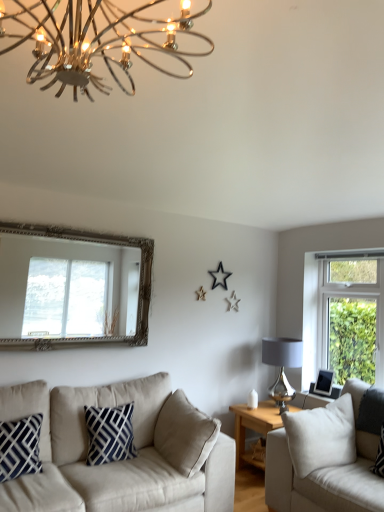
Question: Does black plastic picture frame at right lie in front of wooden side table at center?

Choices:
 (A) no
 (B) yes

Answer: (A)

Question: Is the depth of black plastic picture frame at right greater than that of wooden side table at center?

Choices:
 (A) no
 (B) yes

Answer: (B)

Question: From a real-world perspective, is black plastic picture frame at right located higher than wooden side table at center?

Choices:
 (A) no
 (B) yes

Answer: (B)

Question: Does black plastic picture frame at right have a larger size compared to wooden side table at center?

Choices:
 (A) no
 (B) yes

Answer: (A)

Question: From a real-world perspective, is black plastic picture frame at right below wooden side table at center?

Choices:
 (A) yes
 (B) no

Answer: (B)

Question: Is metallic chandelier at upper center, the first lamp from the front, taller or shorter than silver ornate mirror at upper left?

Choices:
 (A) tall
 (B) short

Answer: (B)

Question: Looking at their shapes, would you say metallic chandelier at upper center, the second lamp positioned from the back, is wider or thinner than silver ornate mirror at upper left?

Choices:
 (A) wide
 (B) thin

Answer: (A)

Question: From a real-world perspective, is metallic chandelier at upper center, which is the 1th lamp in top-to-bottom order, physically located above or below silver ornate mirror at upper left?

Choices:
 (A) below
 (B) above

Answer: (B)

Question: Is metallic chandelier at upper center, acting as the second lamp starting from the right, spatially inside silver ornate mirror at upper left, or outside of it?

Choices:
 (A) outside
 (B) inside

Answer: (A)

Question: Would you say white fabric couch at right, positioned as the 2th studio couch in left-to-right order, is to the left or to the right of beige fabric couch at lower left, which is the 1th studio couch from left to right, in the picture?

Choices:
 (A) left
 (B) right

Answer: (B)

Question: Does point (337, 495) appear closer or farther from the camera than point (109, 470)?

Choices:
 (A) farther
 (B) closer

Answer: (B)

Question: From the image's perspective, relative to beige fabric couch at lower left, which is the 1th studio couch from left to right, is white fabric couch at right, positioned as the 2th studio couch in left-to-right order, above or below?

Choices:
 (A) below
 (B) above

Answer: (A)

Question: From a real-world perspective, is white fabric couch at right, which is counted as the first studio couch, starting from the right, above or below beige fabric couch at lower left, which is the 1th studio couch from left to right?

Choices:
 (A) above
 (B) below

Answer: (A)

Question: Would you say silver ornate mirror at upper left is to the left or to the right of matte gray glass lampshade at right, the first lamp positioned from the bottom, in the picture?

Choices:
 (A) left
 (B) right

Answer: (A)

Question: Does point pos(49,321) appear closer or farther from the camera than point pos(284,404)?

Choices:
 (A) closer
 (B) farther

Answer: (A)